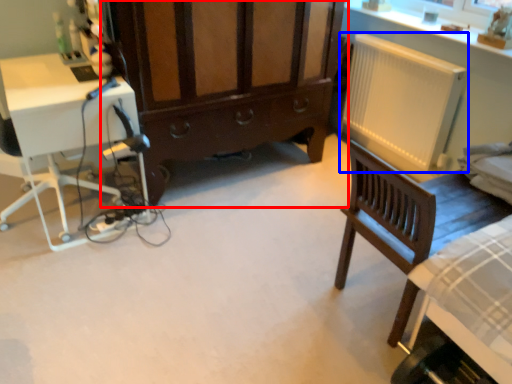
Question: Which of the following is the closest to the observer, cabinetry (highlighted by a red box) or radiator (highlighted by a blue box)?

Choices:
 (A) cabinetry
 (B) radiator

Answer: (A)